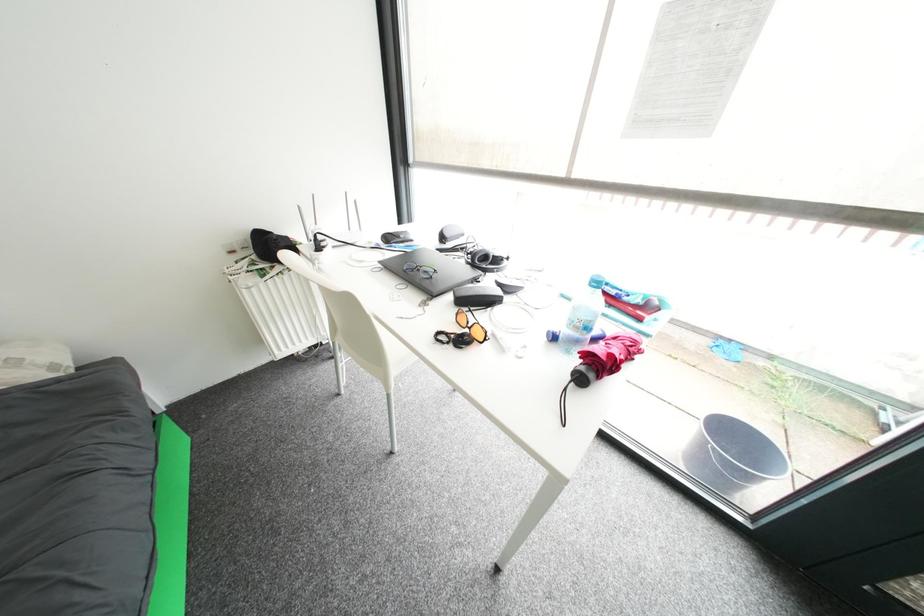
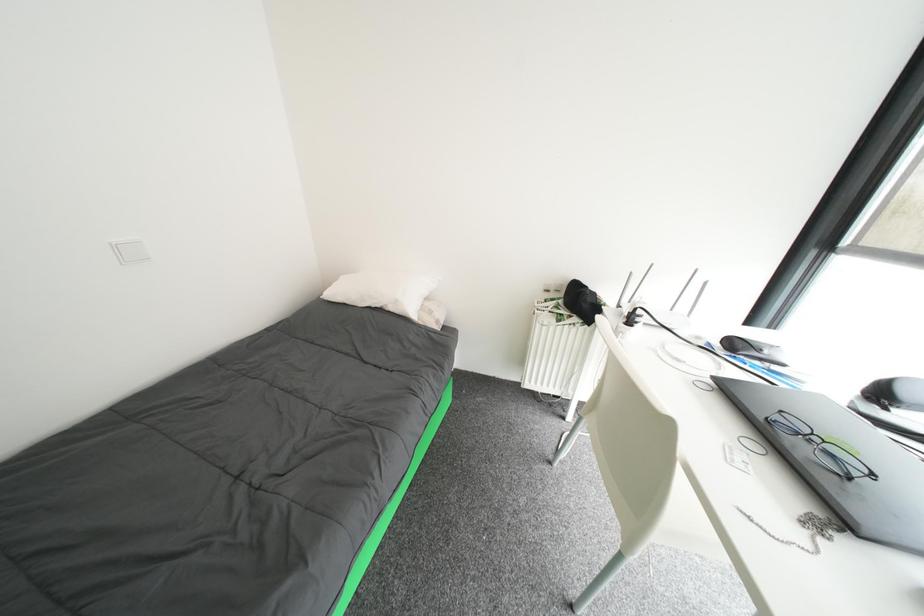
Question: Based on the continuous images, in which direction is the camera rotating? Reply with the corresponding letter.

Choices:
 (A) Left
 (B) Right
 (C) Up
 (D) Down

Answer: (A)